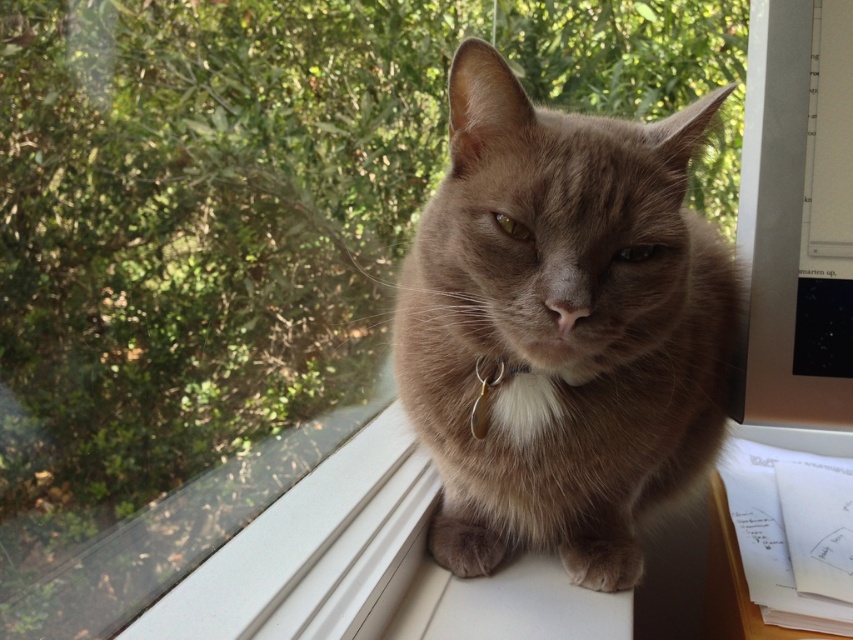
Can you confirm if fuzzy brown cat at center is shorter than silver metallic collar at center?

No.

Who is positioned more to the left, fuzzy brown cat at center or silver metallic collar at center?

silver metallic collar at center is more to the left.

Between point (405, 376) and point (503, 372), which one is positioned in front?

Point (503, 372) is more forward.

Image resolution: width=853 pixels, height=640 pixels. Find the location of `fuzzy brown cat at center`. fuzzy brown cat at center is located at coordinates (561, 326).